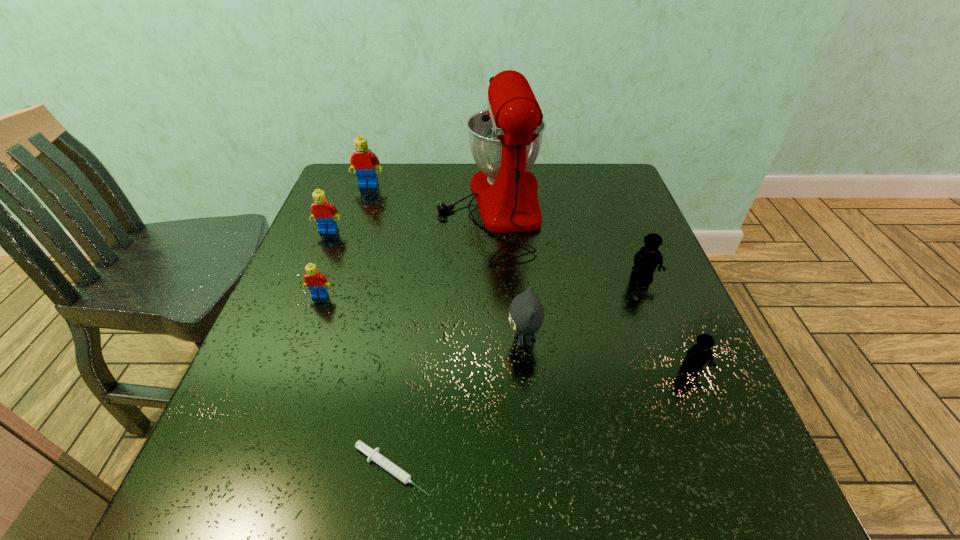
You are a GUI agent. You are given a task and a screenshot of the screen. Output one action in this format:
    pyautogui.click(x=<x>, y=<y>)
    Task: Click on the second closest red Lego to the tallest Lego
    
    Given the screenshot: What is the action you would take?
    pyautogui.click(x=316, y=282)

Where is `blank space that satisfies the following two spatial constraints: 1. on the bowl side of the tallest object; 2. on the face of the fourth nearest Lego`? blank space that satisfies the following two spatial constraints: 1. on the bowl side of the tallest object; 2. on the face of the fourth nearest Lego is located at coordinates (492, 231).

Identify the location of free region that satisfies the following two spatial constraints: 1. on the front-facing side of the fifth nearest object; 2. on the front-facing side of the gray kitten. The height and width of the screenshot is (540, 960). (666, 340).